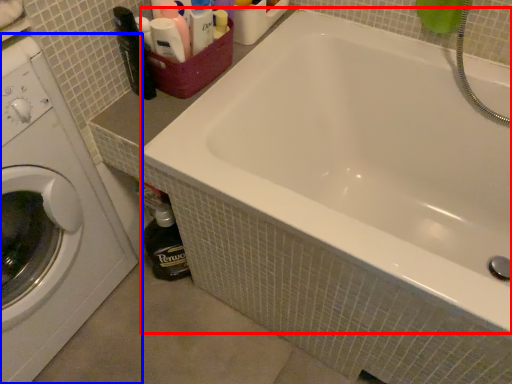
Question: Among these objects, which one is nearest to the camera, bathtub (highlighted by a red box) or washing machine (highlighted by a blue box)?

Choices:
 (A) bathtub
 (B) washing machine

Answer: (B)